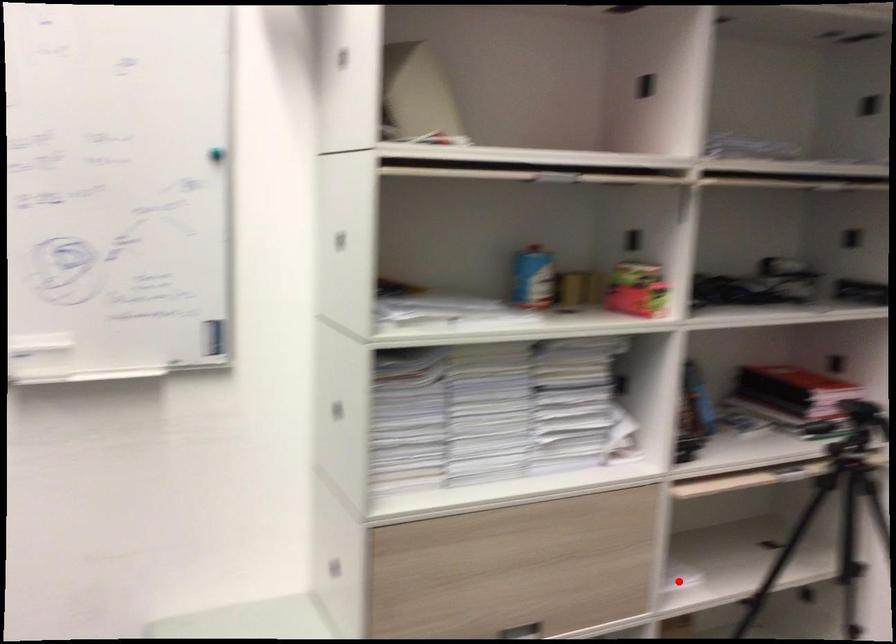
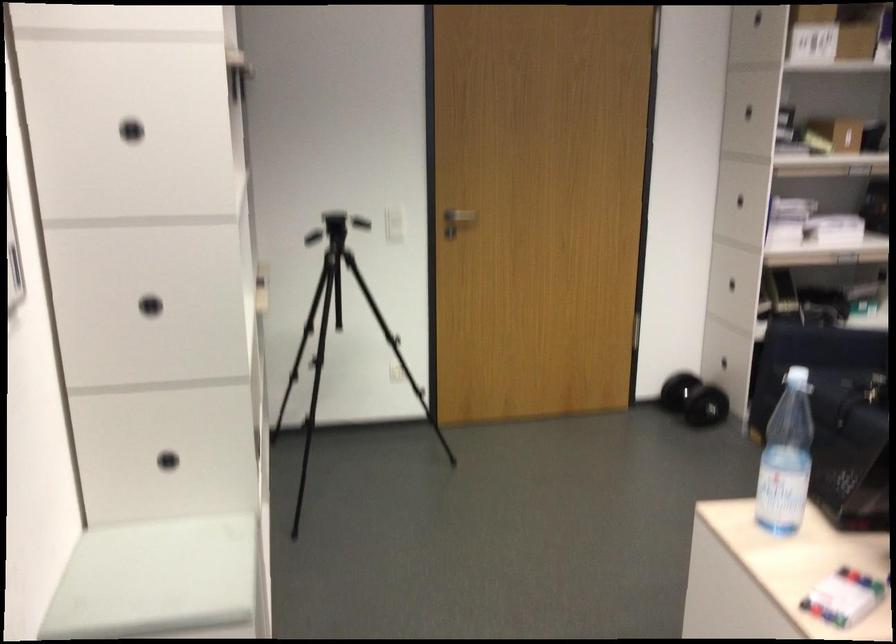
Question: I am providing you with two images of the same scene from different viewpoints. A red point is marked on the first image. Is the red point's position out of view in image 2?

Choices:
 (A) Yes
 (B) No

Answer: (A)